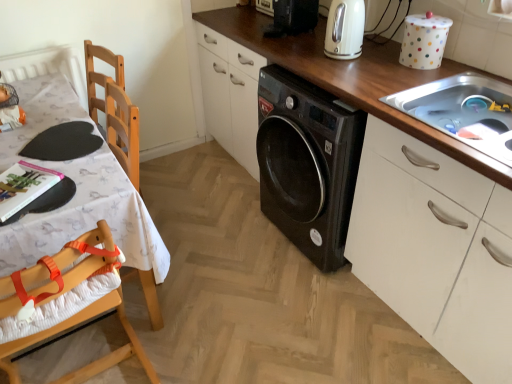
Question: From a real-world perspective, is wooden at center below black plastic washing machine at upper center, the second appliance when ordered from bottom to top?

Choices:
 (A) yes
 (B) no

Answer: (A)

Question: Is wooden at center thinner than black plastic washing machine at upper center, positioned as the 1th appliance in back-to-front order?

Choices:
 (A) no
 (B) yes

Answer: (A)

Question: From the image's perspective, does wooden at center appear lower than black plastic washing machine at upper center, positioned as the 1th appliance in back-to-front order?

Choices:
 (A) yes
 (B) no

Answer: (A)

Question: Is wooden at center shorter than black plastic washing machine at upper center, which is counted as the first appliance, starting from the left?

Choices:
 (A) yes
 (B) no

Answer: (B)

Question: Is wooden at center far away from black plastic washing machine at upper center, the second appliance when ordered from bottom to top?

Choices:
 (A) yes
 (B) no

Answer: (B)

Question: Is point (473, 269) positioned closer to the camera than point (434, 67)?

Choices:
 (A) farther
 (B) closer

Answer: (B)

Question: From a real-world perspective, relative to white polka dot container at upper right, which ranks as the first appliance in right-to-left order, is wooden at center vertically above or below?

Choices:
 (A) above
 (B) below

Answer: (B)

Question: Based on their sizes in the image, would you say wooden at center is bigger or smaller than white polka dot container at upper right, the 1th appliance in the front-to-back sequence?

Choices:
 (A) small
 (B) big

Answer: (B)

Question: Is wooden at center situated inside white polka dot container at upper right, marked as the 1th appliance in a bottom-to-top arrangement, or outside?

Choices:
 (A) inside
 (B) outside

Answer: (B)

Question: Relative to wooden highchair at left, is wooden at center in front or behind?

Choices:
 (A) front
 (B) behind

Answer: (B)

Question: From a real-world perspective, relative to wooden highchair at left, is wooden at center vertically above or below?

Choices:
 (A) above
 (B) below

Answer: (A)

Question: Considering the positions of wooden at center and wooden highchair at left in the image, is wooden at center taller or shorter than wooden highchair at left?

Choices:
 (A) tall
 (B) short

Answer: (A)

Question: Would you say wooden at center is to the left or to the right of wooden highchair at left in the picture?

Choices:
 (A) left
 (B) right

Answer: (B)

Question: In the image, is black plastic washing machine at upper center, which is the 1th appliance from top to bottom, on the left side or the right side of white polka dot container at upper right, the second appliance viewed from the top?

Choices:
 (A) right
 (B) left

Answer: (B)

Question: Considering the positions of point (x=279, y=24) and point (x=436, y=52), is point (x=279, y=24) closer or farther from the camera than point (x=436, y=52)?

Choices:
 (A) farther
 (B) closer

Answer: (A)